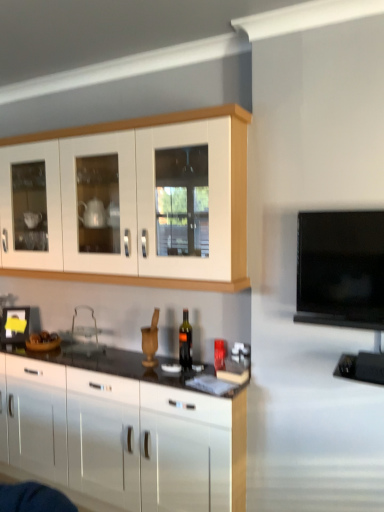
The width and height of the screenshot is (384, 512). What do you see at coordinates (122, 433) in the screenshot?
I see `glossy white cabinets at center, the first cabinetry ordered from the bottom` at bounding box center [122, 433].

Locate an element on the screen. Image resolution: width=384 pixels, height=512 pixels. flat screen tv at right is located at coordinates (341, 269).

At what (x,y) coordinates should I click in order to perform the action: click on white glossy cabinet at upper left, positioned as the 2th cabinetry in bottom-to-top order. Please return your answer as a coordinate pair (x, y). Looking at the image, I should click on (230, 193).

Describe the element at coordinates (185, 342) in the screenshot. I see `dark glass bottle at center` at that location.

The image size is (384, 512). In order to click on glossy white cabinets at center, placed as the 2th cabinetry when sorted from top to bottom in this screenshot , I will do `click(122, 433)`.

Could you tell me if dark glass bottle at center is turned towards flat screen tv at right?

No, dark glass bottle at center is not aimed at flat screen tv at right.

Consider the image. Which is more to the right, dark glass bottle at center or flat screen tv at right?

flat screen tv at right.

From a real-world perspective, is dark glass bottle at center on top of flat screen tv at right?

No, from a real-world perspective, dark glass bottle at center is not over flat screen tv at right

Which of these two, glossy white cabinets at center, the first cabinetry ordered from the bottom, or white glossy cabinet at upper left, positioned as the 2th cabinetry in bottom-to-top order, is smaller?

With smaller size is white glossy cabinet at upper left, positioned as the 2th cabinetry in bottom-to-top order.

Is white glossy cabinet at upper left, arranged as the 1th cabinetry when viewed from the top, at the back of glossy white cabinets at center, placed as the 2th cabinetry when sorted from top to bottom?

No, glossy white cabinets at center, placed as the 2th cabinetry when sorted from top to bottom,'s orientation is not away from white glossy cabinet at upper left, arranged as the 1th cabinetry when viewed from the top.

Is glossy white cabinets at center, placed as the 2th cabinetry when sorted from top to bottom, wider than white glossy cabinet at upper left, positioned as the 2th cabinetry in bottom-to-top order?

Yes.

From a real-world perspective, is glossy white cabinets at center, the first cabinetry ordered from the bottom, positioned above or below white glossy cabinet at upper left, positioned as the 2th cabinetry in bottom-to-top order?

In terms of real-world spatial position, glossy white cabinets at center, the first cabinetry ordered from the bottom, is below white glossy cabinet at upper left, positioned as the 2th cabinetry in bottom-to-top order.

Is white glossy cabinet at upper left, positioned as the 2th cabinetry in bottom-to-top order, oriented away from dark glass bottle at center?

No, white glossy cabinet at upper left, positioned as the 2th cabinetry in bottom-to-top order, is not facing away from dark glass bottle at center.

Considering the points (233, 248) and (185, 365), which point is in front, point (233, 248) or point (185, 365)?

The point (233, 248) is closer.

Can you tell me how much white glossy cabinet at upper left, arranged as the 1th cabinetry when viewed from the top, and dark glass bottle at center differ in facing direction?

They differ by 0.0559 degrees in their facing directions.

Identify the location of bottle that appears behind the white glossy cabinet at upper left, arranged as the 1th cabinetry when viewed from the top. (185, 342).

Can you confirm if white glossy cabinet at upper left, positioned as the 2th cabinetry in bottom-to-top order, is taller than flat screen tv at right?

Yes, white glossy cabinet at upper left, positioned as the 2th cabinetry in bottom-to-top order, is taller than flat screen tv at right.

Are white glossy cabinet at upper left, positioned as the 2th cabinetry in bottom-to-top order, and flat screen tv at right far apart?

No, there isn't a large distance between white glossy cabinet at upper left, positioned as the 2th cabinetry in bottom-to-top order, and flat screen tv at right.

From a real-world perspective, which object stands above the other?

white glossy cabinet at upper left, positioned as the 2th cabinetry in bottom-to-top order, is physically above.

Are flat screen tv at right and glossy white cabinets at center, the first cabinetry ordered from the bottom, making contact?

No, flat screen tv at right is not with glossy white cabinets at center, the first cabinetry ordered from the bottom.

From a real-world perspective, which is physically above, flat screen tv at right or glossy white cabinets at center, the first cabinetry ordered from the bottom?

flat screen tv at right is physically above.

Looking at this image, considering the sizes of objects flat screen tv at right and glossy white cabinets at center, placed as the 2th cabinetry when sorted from top to bottom, in the image provided, who is bigger, flat screen tv at right or glossy white cabinets at center, placed as the 2th cabinetry when sorted from top to bottom,?

Bigger between the two is glossy white cabinets at center, placed as the 2th cabinetry when sorted from top to bottom.

Is point (298, 250) positioned in front of point (172, 445)?

Yes, point (298, 250) is closer to viewer.

Where is `bottle that is under the white glossy cabinet at upper left, positioned as the 2th cabinetry in bottom-to-top order (from a real-world perspective)`? Image resolution: width=384 pixels, height=512 pixels. bottle that is under the white glossy cabinet at upper left, positioned as the 2th cabinetry in bottom-to-top order (from a real-world perspective) is located at coordinates (185, 342).

Which is further, (179, 330) or (236, 269)?

The point (179, 330) is farther from the camera.

Is dark glass bottle at center inside the boundaries of white glossy cabinet at upper left, arranged as the 1th cabinetry when viewed from the top, or outside?

dark glass bottle at center is outside white glossy cabinet at upper left, arranged as the 1th cabinetry when viewed from the top.

Is dark glass bottle at center far from white glossy cabinet at upper left, positioned as the 2th cabinetry in bottom-to-top order?

No, dark glass bottle at center is in close proximity to white glossy cabinet at upper left, positioned as the 2th cabinetry in bottom-to-top order.

You are a GUI agent. You are given a task and a screenshot of the screen. Output one action in this format:
    pyautogui.click(x=<x>, y=<y>)
    Task: Click on the cabinetry that is the 2nd object to the left of the dark glass bottle at center, starting at the anchor
    This screenshot has width=384, height=512.
    Given the screenshot: What is the action you would take?
    pyautogui.click(x=122, y=433)

Does dark glass bottle at center have a lesser height compared to glossy white cabinets at center, the first cabinetry ordered from the bottom?

Correct, dark glass bottle at center is not as tall as glossy white cabinets at center, the first cabinetry ordered from the bottom.

Is dark glass bottle at center not inside glossy white cabinets at center, the first cabinetry ordered from the bottom?

Yes, dark glass bottle at center is located beyond the bounds of glossy white cabinets at center, the first cabinetry ordered from the bottom.

Is dark glass bottle at center far away from glossy white cabinets at center, placed as the 2th cabinetry when sorted from top to bottom?

Actually, dark glass bottle at center and glossy white cabinets at center, placed as the 2th cabinetry when sorted from top to bottom, are a little close together.

Locate an element on the screen. television in front of the dark glass bottle at center is located at coordinates (341, 269).

The image size is (384, 512). I want to click on cabinetry located above the glossy white cabinets at center, the first cabinetry ordered from the bottom (from a real-world perspective), so click(230, 193).

Which object lies further to the anchor point dark glass bottle at center, flat screen tv at right or glossy white cabinets at center, the first cabinetry ordered from the bottom?

flat screen tv at right is positioned further to the anchor dark glass bottle at center.

Estimate the real-world distances between objects in this image. Which object is further from dark glass bottle at center, white glossy cabinet at upper left, arranged as the 1th cabinetry when viewed from the top, or glossy white cabinets at center, the first cabinetry ordered from the bottom?

Among the two, white glossy cabinet at upper left, arranged as the 1th cabinetry when viewed from the top, is located further to dark glass bottle at center.

Based on their spatial positions, is glossy white cabinets at center, placed as the 2th cabinetry when sorted from top to bottom, or flat screen tv at right further from white glossy cabinet at upper left, positioned as the 2th cabinetry in bottom-to-top order?

glossy white cabinets at center, placed as the 2th cabinetry when sorted from top to bottom, is positioned further to the anchor white glossy cabinet at upper left, positioned as the 2th cabinetry in bottom-to-top order.

From the image, which object appears to be nearer to white glossy cabinet at upper left, arranged as the 1th cabinetry when viewed from the top, glossy white cabinets at center, the first cabinetry ordered from the bottom, or dark glass bottle at center?

dark glass bottle at center.

Based on their spatial positions, is dark glass bottle at center or white glossy cabinet at upper left, positioned as the 2th cabinetry in bottom-to-top order, closer to flat screen tv at right?

The object closer to flat screen tv at right is white glossy cabinet at upper left, positioned as the 2th cabinetry in bottom-to-top order.

In the scene shown: Considering their positions, is flat screen tv at right positioned further to dark glass bottle at center than white glossy cabinet at upper left, arranged as the 1th cabinetry when viewed from the top?

The object further to dark glass bottle at center is flat screen tv at right.

Looking at the image, which one is located closer to white glossy cabinet at upper left, arranged as the 1th cabinetry when viewed from the top, dark glass bottle at center or flat screen tv at right?

Among the two, flat screen tv at right is located nearer to white glossy cabinet at upper left, arranged as the 1th cabinetry when viewed from the top.

From the image, which object appears to be nearer to flat screen tv at right, glossy white cabinets at center, placed as the 2th cabinetry when sorted from top to bottom, or dark glass bottle at center?

Among the two, dark glass bottle at center is located nearer to flat screen tv at right.

Where is `bottle situated between white glossy cabinet at upper left, arranged as the 1th cabinetry when viewed from the top, and flat screen tv at right from left to right`? bottle situated between white glossy cabinet at upper left, arranged as the 1th cabinetry when viewed from the top, and flat screen tv at right from left to right is located at coordinates (185, 342).

Identify the location of bottle situated between glossy white cabinets at center, placed as the 2th cabinetry when sorted from top to bottom, and flat screen tv at right from left to right. (185, 342).

You are a GUI agent. You are given a task and a screenshot of the screen. Output one action in this format:
    pyautogui.click(x=<x>, y=<y>)
    Task: Click on the bottle that lies between white glossy cabinet at upper left, arranged as the 1th cabinetry when viewed from the top, and glossy white cabinets at center, the first cabinetry ordered from the bottom, from top to bottom
    
    Given the screenshot: What is the action you would take?
    pyautogui.click(x=185, y=342)

Where is `cabinetry located between glossy white cabinets at center, the first cabinetry ordered from the bottom, and flat screen tv at right in the left-right direction`? This screenshot has height=512, width=384. cabinetry located between glossy white cabinets at center, the first cabinetry ordered from the bottom, and flat screen tv at right in the left-right direction is located at coordinates (230, 193).